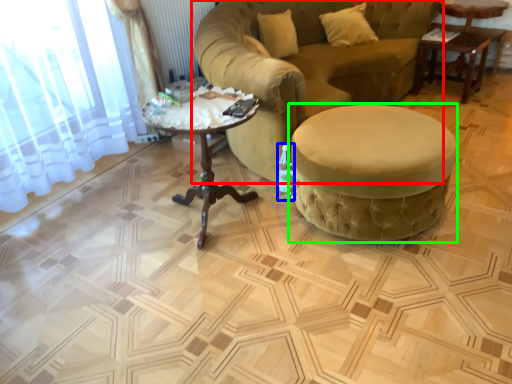
Question: Based on their relative distances, which object is farther from studio couch (highlighted by a red box)? Choose from bottle (highlighted by a blue box) and table (highlighted by a green box).

Choices:
 (A) bottle
 (B) table

Answer: (A)